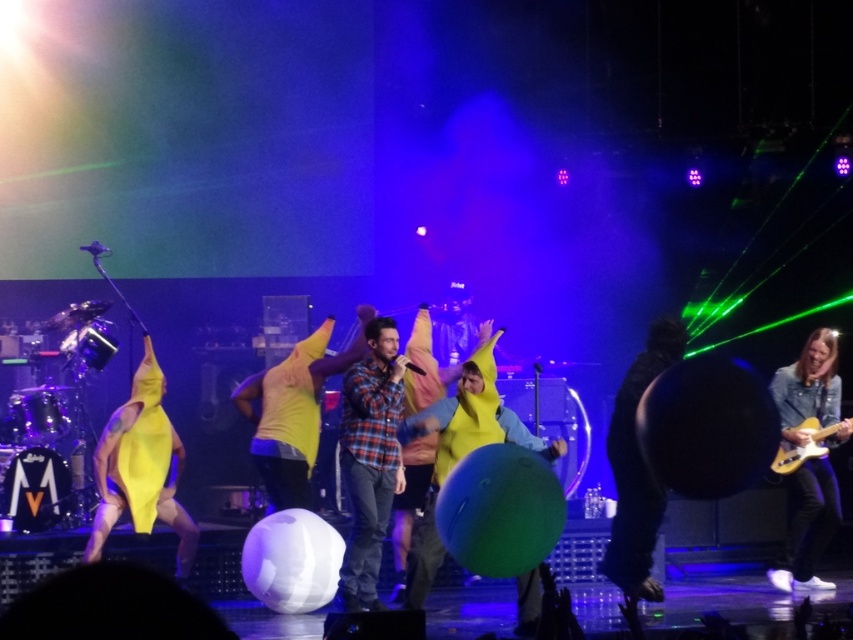
Where is `yellow rubber banana at center`? Image resolution: width=853 pixels, height=640 pixels. yellow rubber banana at center is located at coordinates (460, 452).

Does point (474, 353) come behind point (635, 406)?

Yes, point (474, 353) is farther from viewer.

Find the location of a particular element. yellow rubber banana at center is located at coordinates (460, 452).

Which is behind, point (132, 502) or point (636, 541)?

The point (132, 502) is behind.

Where is `yellow fabric banana at left`? Image resolution: width=853 pixels, height=640 pixels. yellow fabric banana at left is located at coordinates (141, 467).

Is plaid flannel shirt at center wider than yellow matte banana at center?

Incorrect, plaid flannel shirt at center's width does not surpass yellow matte banana at center's.

Measure the distance between point (345,376) and camera.

Point (345,376) and camera are 6.86 meters apart.

I want to click on plaid flannel shirt at center, so click(370, 458).